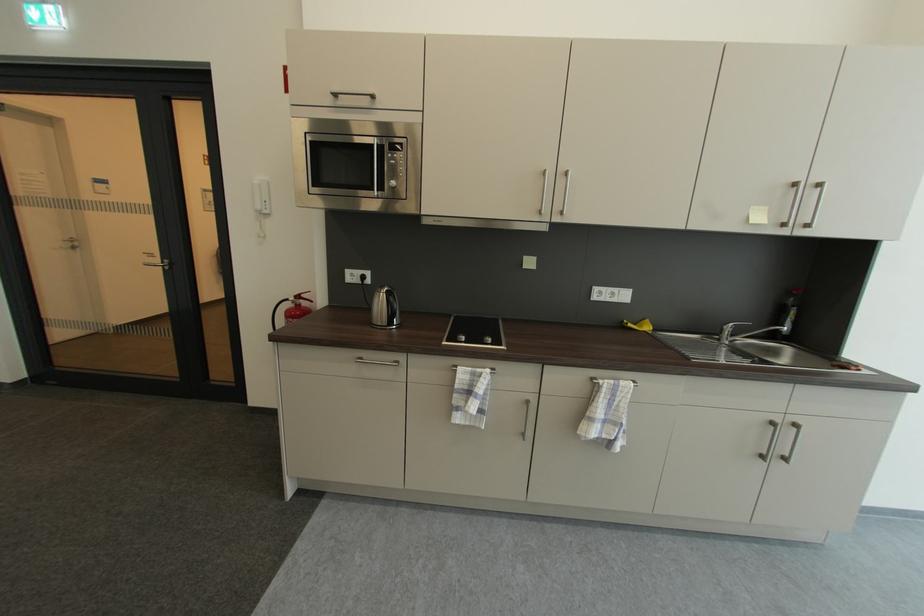
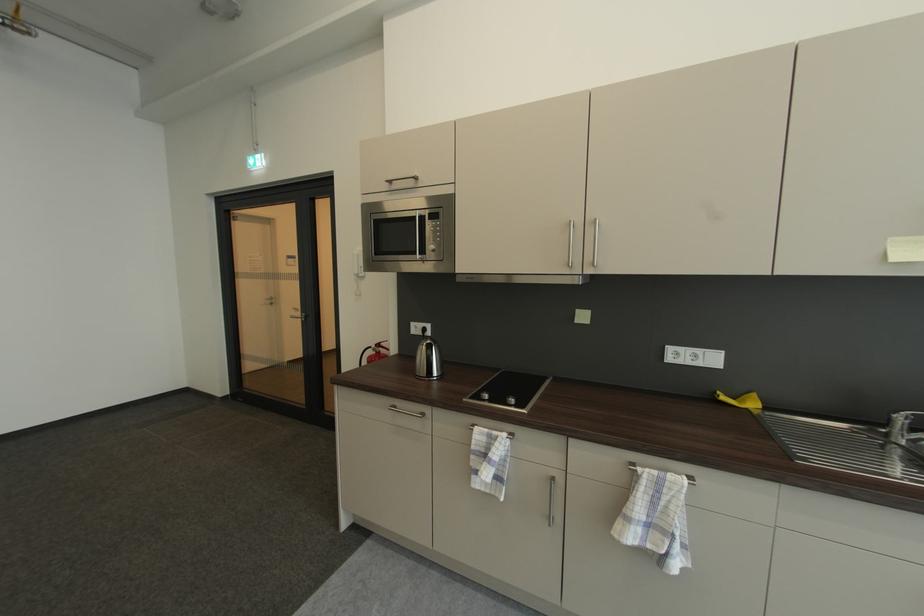
Where in the second image is the point corresponding to (x=264, y=208) from the first image?

(362, 273)